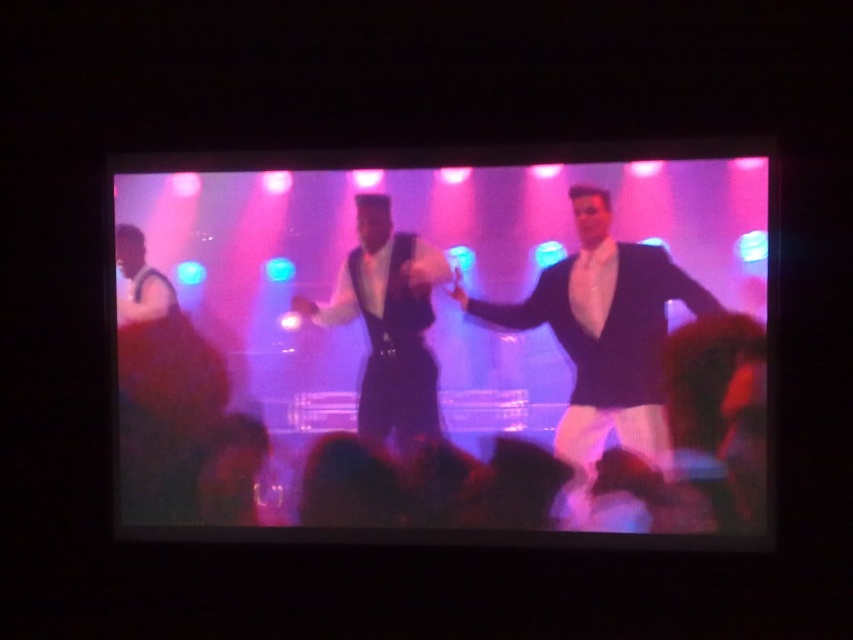
Which of these two, matte black suit at center or matte white vest at left, stands shorter?

matte white vest at left

Does matte black suit at center have a lesser width compared to matte white vest at left?

No, matte black suit at center is not thinner than matte white vest at left.

Is point (741, 188) behind point (135, 244)?

No, it is not.

This screenshot has width=853, height=640. What are the coordinates of `matte black suit at center` in the screenshot? It's located at (450, 346).

Is point (498, 488) positioned in front of point (560, 301)?

No, it is not.

Between point (598, 328) and point (605, 310), which one is positioned behind?

The point (598, 328) is behind.

Where is `matte black suit at center`? This screenshot has width=853, height=640. matte black suit at center is located at coordinates (450, 346).

Does matte black suit at center have a greater height compared to shiny black vest at center?

Yes, matte black suit at center is taller than shiny black vest at center.

Looking at this image, who is more forward, (x=171, y=284) or (x=402, y=289)?

Positioned in front is point (x=402, y=289).

Find the location of a particular element. matte black suit at center is located at coordinates (450, 346).

At what (x,y) coordinates should I click in order to perform the action: click on matte black suit at center. Please return your answer as a coordinate pair (x, y). The height and width of the screenshot is (640, 853). Looking at the image, I should click on (450, 346).